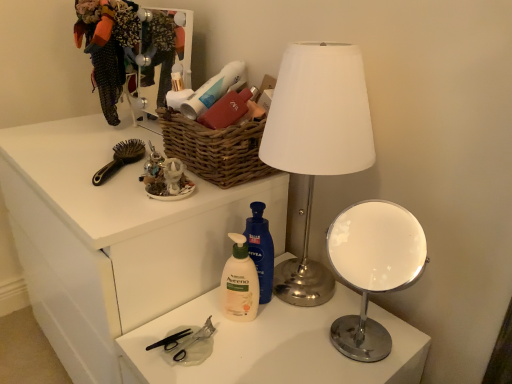
Question: From the image's perspective, is woven brown basket at upper center positioned above or below white matte desk at center?

Choices:
 (A) above
 (B) below

Answer: (A)

Question: Is point pos(163,122) closer or farther from the camera than point pos(90,369)?

Choices:
 (A) farther
 (B) closer

Answer: (B)

Question: Estimate the real-world distances between objects in this image. Which object is farther from the white plastic table at center?

Choices:
 (A) patterned fabric dress at upper left
 (B) chrome/metallic table lamp at right
 (C) white plastic pump bottle at center, the 2th cleaning product viewed from the left
 (D) woven brown basket at upper center
 (E) white matte desk at center

Answer: (A)

Question: Which object is the closest to the patterned fabric dress at upper left?

Choices:
 (A) black plastic brush at upper left
 (B) metallic silver mirror at upper center
 (C) chrome/metallic table lamp at right
 (D) metallic silver lamp at center
 (E) black plastic scissors at lower center

Answer: (B)